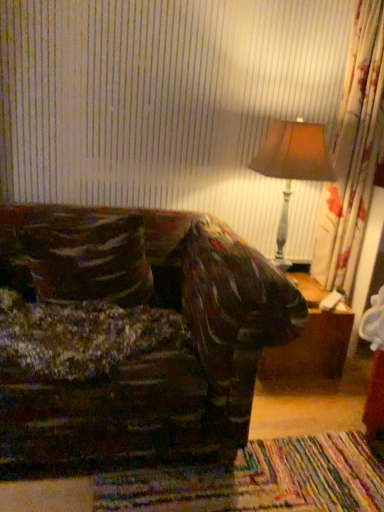
Question: Considering the relative positions of velvety brown throw pillow at left and brown wooden table at lower right in the image provided, is velvety brown throw pillow at left to the left of brown wooden table at lower right from the viewer's perspective?

Choices:
 (A) yes
 (B) no

Answer: (A)

Question: Considering the relative positions of velvety brown throw pillow at left and brown wooden table at lower right in the image provided, is velvety brown throw pillow at left to the right of brown wooden table at lower right from the viewer's perspective?

Choices:
 (A) no
 (B) yes

Answer: (A)

Question: From a real-world perspective, is velvety brown throw pillow at left physically above brown wooden table at lower right?

Choices:
 (A) yes
 (B) no

Answer: (A)

Question: Is velvety brown throw pillow at left next to brown wooden table at lower right?

Choices:
 (A) yes
 (B) no

Answer: (B)

Question: Does velvety brown throw pillow at left have a larger size compared to brown wooden table at lower right?

Choices:
 (A) yes
 (B) no

Answer: (B)

Question: From the image's perspective, relative to matte brown lampshade at upper right, is velvety brown throw pillow at left above or below?

Choices:
 (A) below
 (B) above

Answer: (A)

Question: Which is correct: velvety brown throw pillow at left is inside matte brown lampshade at upper right, or outside of it?

Choices:
 (A) outside
 (B) inside

Answer: (A)

Question: Considering the positions of point (8, 248) and point (288, 170), is point (8, 248) closer or farther from the camera than point (288, 170)?

Choices:
 (A) farther
 (B) closer

Answer: (B)

Question: Considering the positions of velvety brown throw pillow at left and matte brown lampshade at upper right in the image, is velvety brown throw pillow at left taller or shorter than matte brown lampshade at upper right?

Choices:
 (A) short
 (B) tall

Answer: (A)

Question: In the image, is matte brown lampshade at upper right positioned in front of or behind brown wooden table at lower right?

Choices:
 (A) front
 (B) behind

Answer: (A)

Question: Is matte brown lampshade at upper right situated inside brown wooden table at lower right or outside?

Choices:
 (A) inside
 (B) outside

Answer: (B)

Question: Is matte brown lampshade at upper right to the left or to the right of brown wooden table at lower right in the image?

Choices:
 (A) left
 (B) right

Answer: (A)

Question: Considering the positions of matte brown lampshade at upper right and brown wooden table at lower right in the image, is matte brown lampshade at upper right bigger or smaller than brown wooden table at lower right?

Choices:
 (A) small
 (B) big

Answer: (B)

Question: In terms of size, does velvety brown throw pillow at left appear bigger or smaller than brown wooden table at lower right?

Choices:
 (A) small
 (B) big

Answer: (A)

Question: From the image's perspective, is velvety brown throw pillow at left above or below brown wooden table at lower right?

Choices:
 (A) above
 (B) below

Answer: (A)